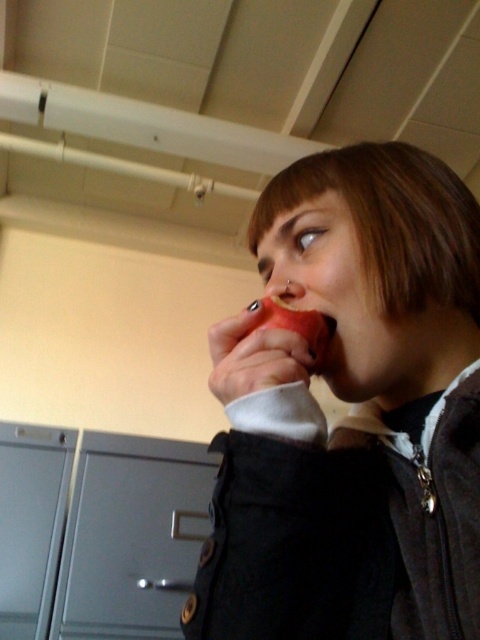
You are standing in the room and want to reach both points. Which point is closer to you, point (156, 509) or point (305, 314)?

Point (156, 509) is further to the camera than point (305, 314), so point (305, 314) is closer to you.